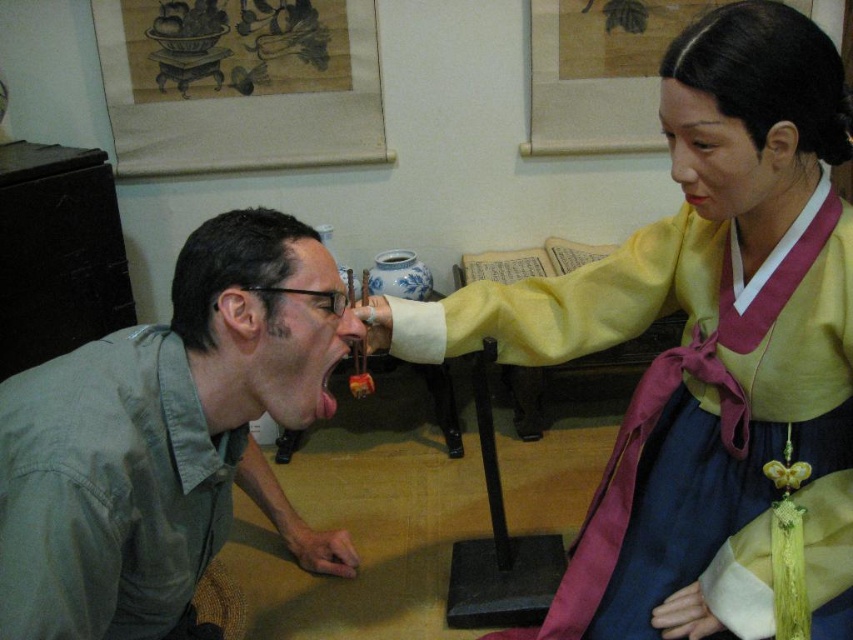
Question: Which point appears farthest from the camera in this image?

Choices:
 (A) (819, 330)
 (B) (131, 349)

Answer: (A)

Question: Can you confirm if matte yellow fabric at upper right is positioned to the left of green cotton shirt at lower left?

Choices:
 (A) yes
 (B) no

Answer: (B)

Question: Does matte yellow fabric at upper right appear on the right side of green cotton shirt at lower left?

Choices:
 (A) yes
 (B) no

Answer: (A)

Question: Which point appears closest to the camera in this image?

Choices:
 (A) (828, 122)
 (B) (141, 573)
 (C) (311, 237)

Answer: (B)

Question: Is matte yellow fabric at upper right in front of green cotton shirt at lower left?

Choices:
 (A) yes
 (B) no

Answer: (B)

Question: Which object appears farthest from the camera in this image?

Choices:
 (A) matte yellow fabric at upper right
 (B) green matte shirt at lower left

Answer: (A)